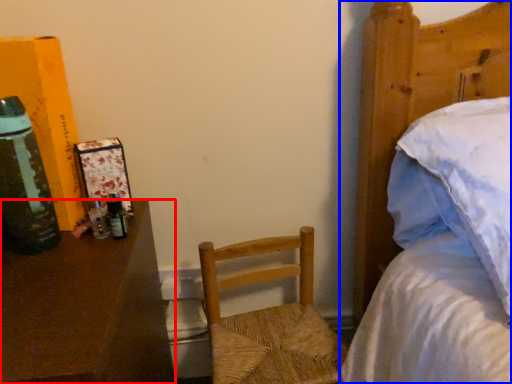
Question: Which object appears farthest to the camera in this image, desk (highlighted by a red box) or bed (highlighted by a blue box)?

Choices:
 (A) desk
 (B) bed

Answer: (A)